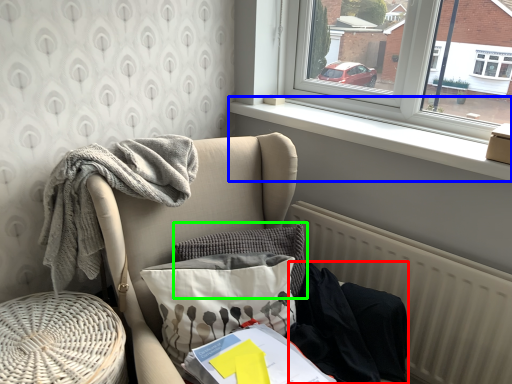
Question: Which is nearer to the clothing (highlighted by a red box)? window sill (highlighted by a blue box) or pillow (highlighted by a green box).

Choices:
 (A) window sill
 (B) pillow

Answer: (B)